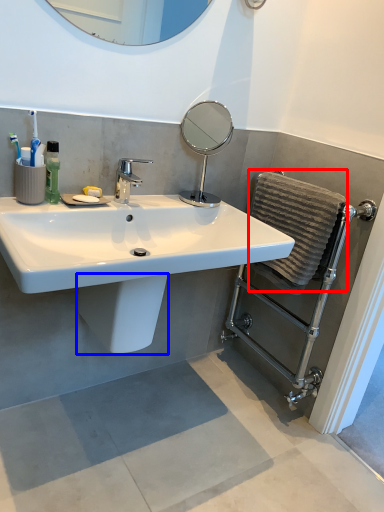
Question: Among these objects, which one is nearest to the camera, bath towel (highlighted by a red box) or bidet (highlighted by a blue box)?

Choices:
 (A) bath towel
 (B) bidet

Answer: (B)